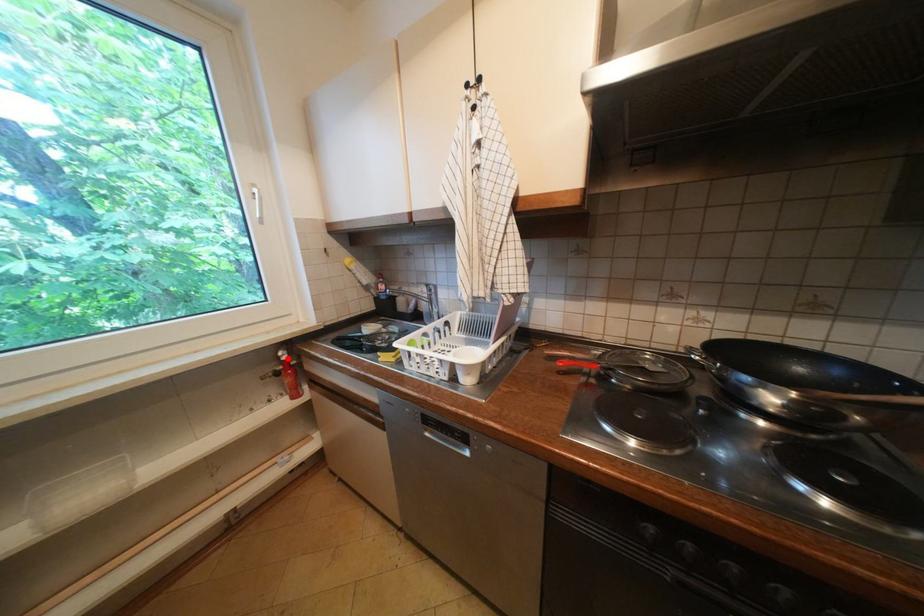
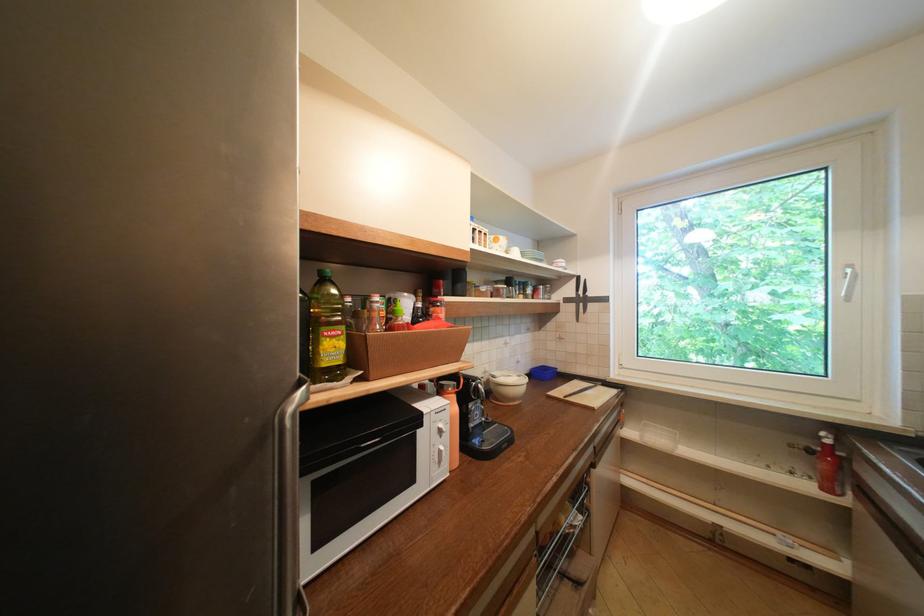
Question: I am providing you with two images of the same scene from different viewpoints. A red point is marked on the first image. Can you still see the location of the red point in image 2?

Choices:
 (A) Yes
 (B) No

Answer: (A)